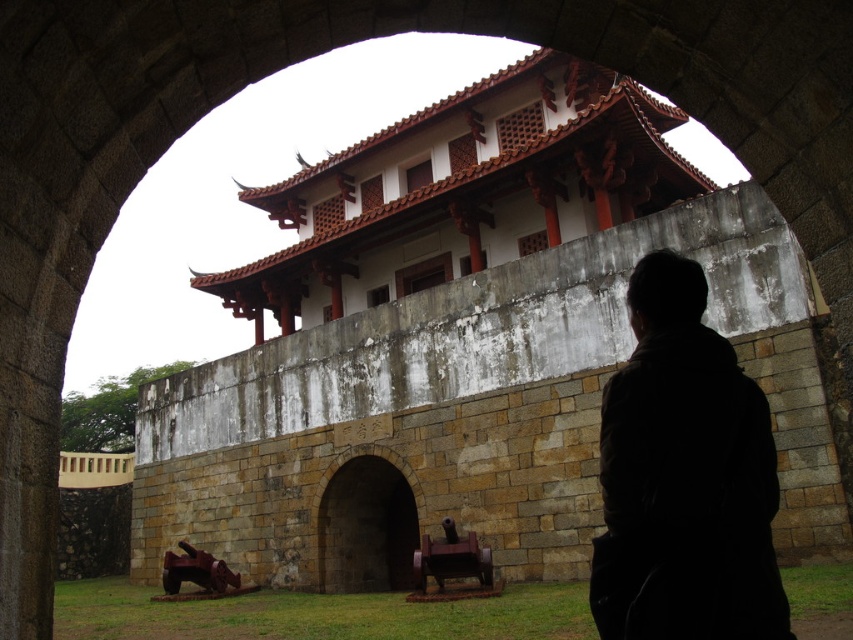
Question: Does black matte coat at lower right appear under brown stone archway at center?

Choices:
 (A) no
 (B) yes

Answer: (A)

Question: Is black matte coat at lower right bigger than brown stone archway at center?

Choices:
 (A) yes
 (B) no

Answer: (A)

Question: Which point is closer to the camera taking this photo?

Choices:
 (A) (381, 502)
 (B) (692, 403)

Answer: (B)

Question: Which of the following is the closest to the observer?

Choices:
 (A) black matte coat at lower right
 (B) brown stone archway at center

Answer: (A)

Question: Is the position of black matte coat at lower right less distant than that of brown stone archway at center?

Choices:
 (A) yes
 (B) no

Answer: (A)